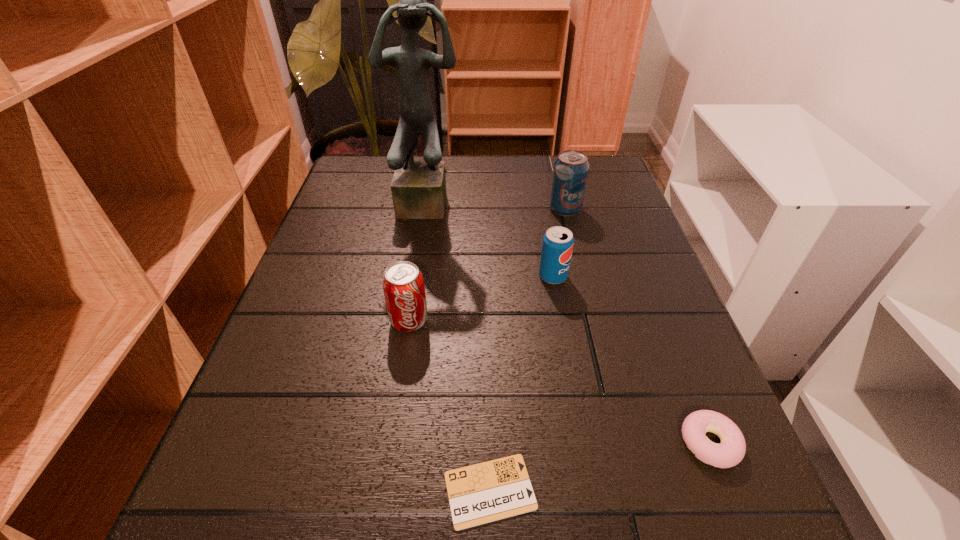
The image size is (960, 540). I want to click on free area in between the doughnut and the fourth nearest object, so click(632, 360).

This screenshot has height=540, width=960. I want to click on blank region between the shortest object and the sculpture, so click(x=460, y=346).

Where is `vacant area that lies between the tallest object and the shortest object`? vacant area that lies between the tallest object and the shortest object is located at coordinates (460, 346).

Locate an element on the screen. This screenshot has height=540, width=960. vacant space that's between the fourth farthest object and the second nearest soda can is located at coordinates (481, 299).

What are the coordinates of `vacant space in between the doughnut and the fourth farthest object` in the screenshot? It's located at (560, 382).

Where is `the fourth closest object to the tallest object`? The height and width of the screenshot is (540, 960). the fourth closest object to the tallest object is located at coordinates (497, 489).

Locate an element on the screen. Image resolution: width=960 pixels, height=540 pixels. object that is the fourth closest to the fourth farthest object is located at coordinates (570, 173).

Locate an element on the screen. The width and height of the screenshot is (960, 540). the closest soda can to the third nearest object is located at coordinates (557, 246).

Locate an element on the screen. The height and width of the screenshot is (540, 960). soda can that can be found as the second closest to the farthest soda can is located at coordinates (403, 285).

I want to click on vacant space that satisfies the following two spatial constraints: 1. on the face of the farthest soda can; 2. on the left side of the tallest object, so click(428, 208).